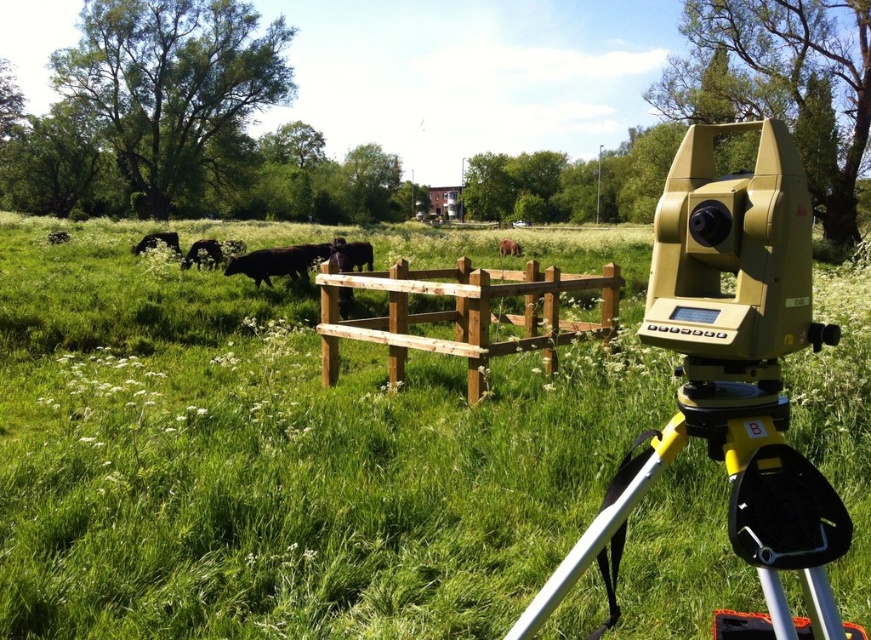
You are a photographer setting up equipment in the field. You have a camera and a yellow plastic tripod at lower right. You need to ensure that the distance between them is at least 4 feet to avoid interference with your equipment setup. Based on the scene description, is the current distance sufficient?

The yellow plastic tripod at lower right and camera are 4.01 feet apart from each other. Since 4.01 feet is just over 4 feet, the distance is sufficient to avoid interference with your equipment setup.

You are a land surveyor standing at the base of the yellow plastic tripod at lower right. You want to walk towards the black matte cow at upper left. Which direction should you move relative to the tripod?

The yellow plastic tripod at lower right is located below the black matte cow at upper left, so you should move upward from the tripod to reach the cow.

You are a farmer who wants to check the distance between the yellow plastic tripod at lower right and the black glossy cow at center. Which one is nearer to you?

The yellow plastic tripod at lower right is closer to the viewer than the black glossy cow at center.